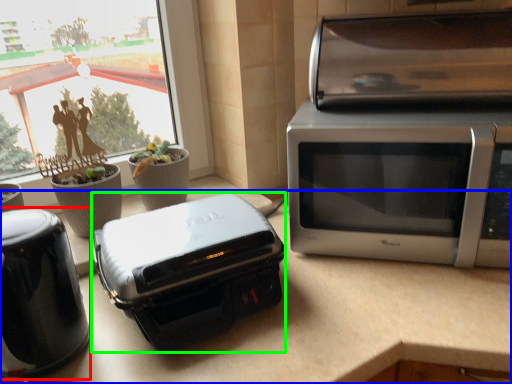
Question: Based on their relative distances, which object is nearer to home appliance (highlighted by a red box)? Choose from counter top (highlighted by a blue box) and toaster (highlighted by a green box).

Choices:
 (A) counter top
 (B) toaster

Answer: (B)